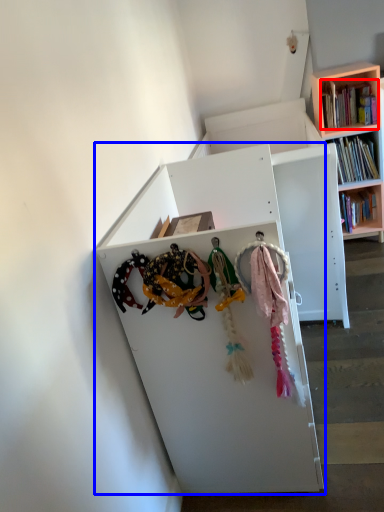
Question: Which of the following is the farthest to the observer, book (highlighted by a red box) or shelf (highlighted by a blue box)?

Choices:
 (A) book
 (B) shelf

Answer: (A)